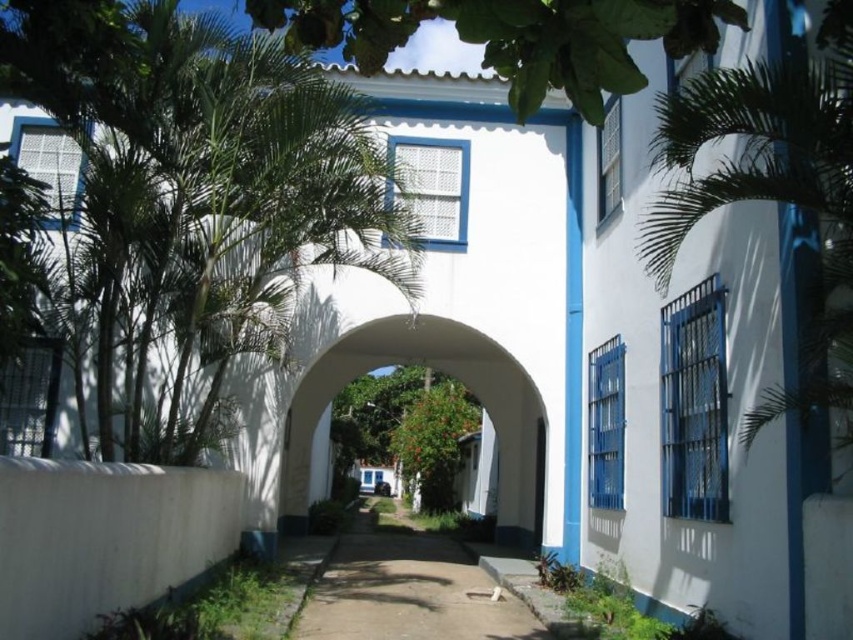
Describe the element at coordinates (775, 193) in the screenshot. This screenshot has width=853, height=640. I see `green leafy palm at right` at that location.

Is point (817, 260) behind point (589, 88)?

Yes, it is.

Is point (670, 244) closer to viewer compared to point (344, 49)?

No.

Find the location of a particular element. The image size is (853, 640). green leafy palm at right is located at coordinates (775, 193).

Where is `green leafy palm at right`? green leafy palm at right is located at coordinates (775, 193).

Does green leafy palm at right have a lesser width compared to green leafy tree at center?

Yes.

Between point (682, 236) and point (341, 420), which one is positioned behind?

Point (341, 420)

At what (x,y) coordinates should I click in order to perform the action: click on green leafy palm at right. Please return your answer as a coordinate pair (x, y). This screenshot has width=853, height=640. Looking at the image, I should click on (775, 193).

Which is behind, point (352, 540) or point (346, 440)?

The point (346, 440) is more distant.

This screenshot has height=640, width=853. Describe the element at coordinates (407, 588) in the screenshot. I see `brown dirt path at center` at that location.

Where is `brown dirt path at center`? brown dirt path at center is located at coordinates (407, 588).